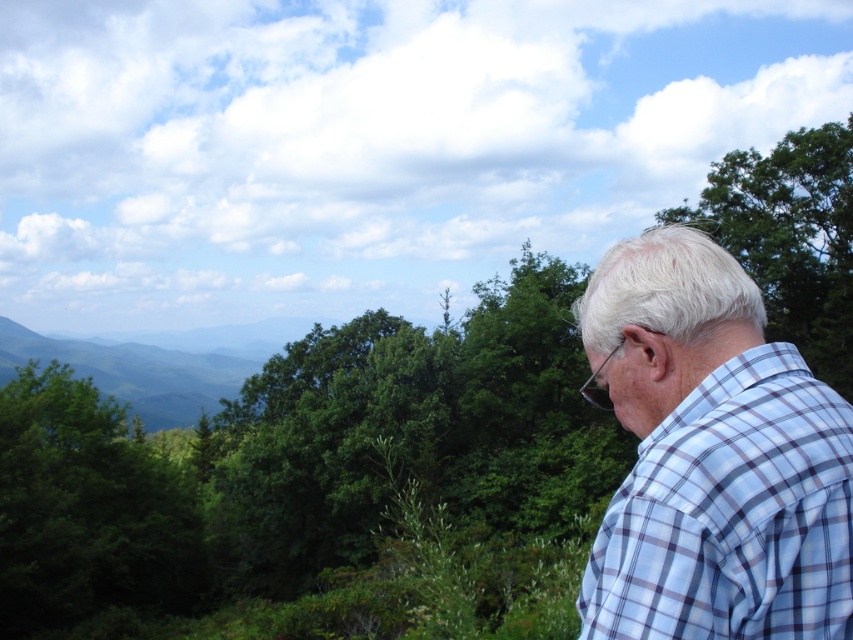
Based on the scene description, where is the green leafy tree at left located in the image?

The green leafy tree at left is located at point (86, 508) in the image.

You are a photographer trying to capture the light blue plaid shirt at right and the green leafy tree at left in the same frame. Based on their heights, which object will appear smaller in the photo?

The light blue plaid shirt at right is shorter than the green leafy tree at left, so it will appear smaller in the photo.

You are a photographer trying to capture the light blue plaid shirt at right and the green leafy tree at upper right in the same frame. Based on their positions, which object is positioned lower in the image?

The light blue plaid shirt at right is located below the green leafy tree at upper right, so the light blue plaid shirt at right is positioned lower in the image.